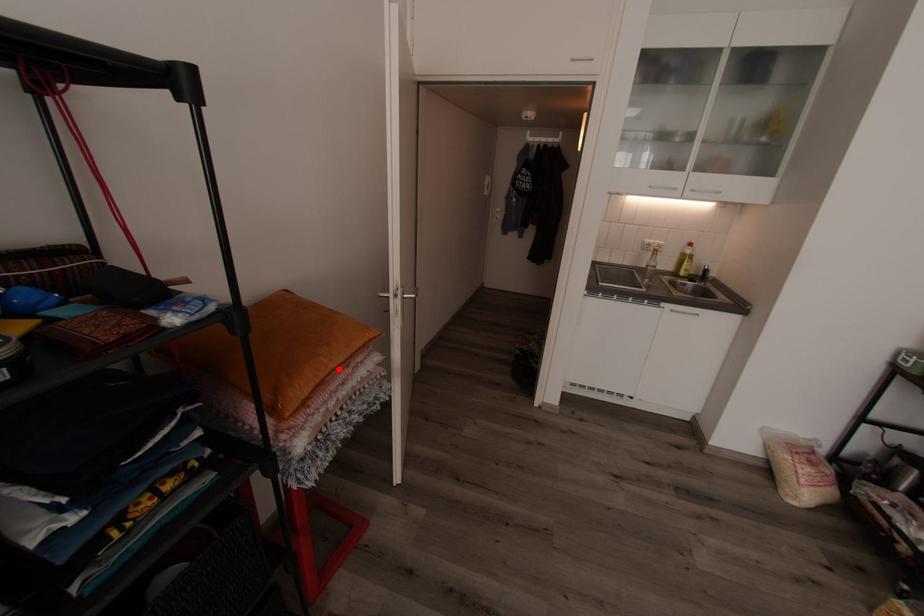
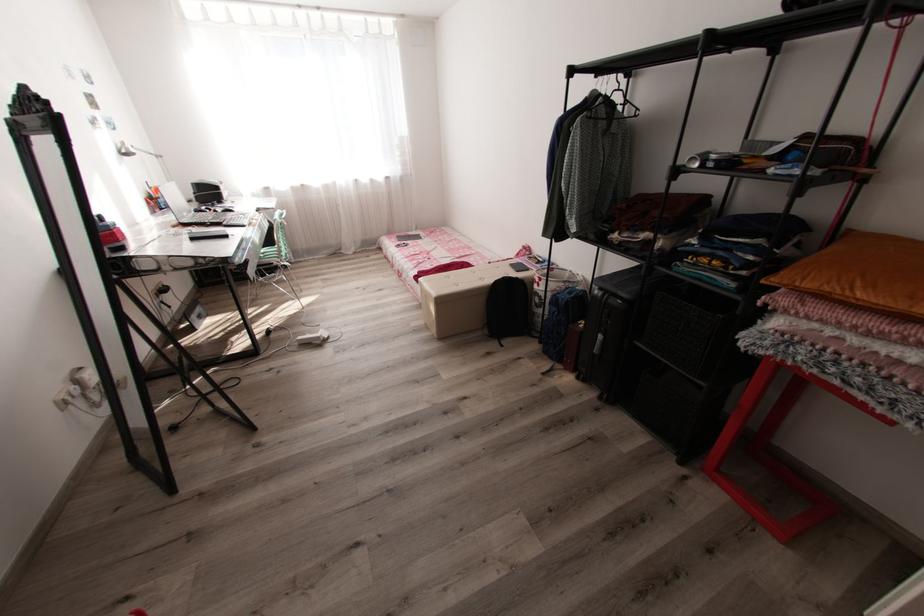
The point at the highlighted location is marked in the first image. Where is the corresponding point in the second image?

(861, 299)